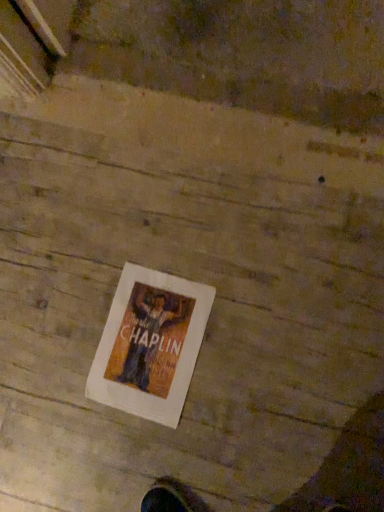
Image resolution: width=384 pixels, height=512 pixels. Describe the element at coordinates (150, 344) in the screenshot. I see `white paper poster at center` at that location.

This screenshot has width=384, height=512. I want to click on white paper poster at center, so click(x=150, y=344).

You are a GUI agent. You are given a task and a screenshot of the screen. Output one action in this format:
    pyautogui.click(x=<x>, y=<y>)
    Task: Click on the white paper poster at center
    Image resolution: width=384 pixels, height=512 pixels.
    Given the screenshot: What is the action you would take?
    pyautogui.click(x=150, y=344)